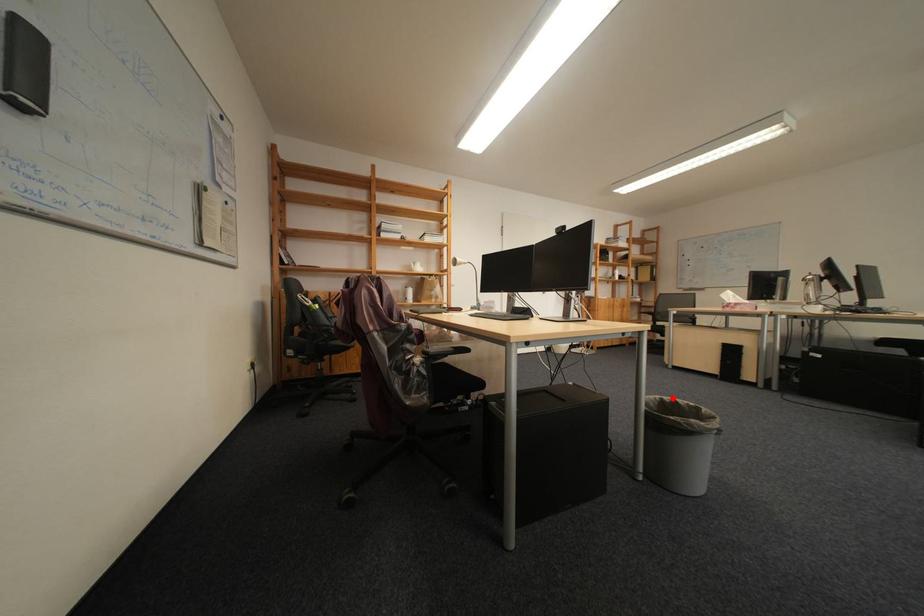
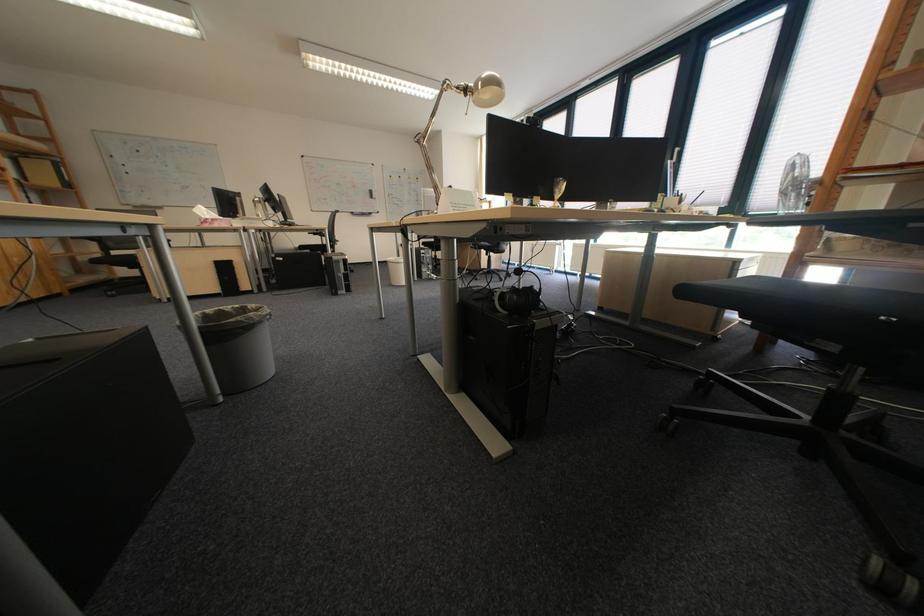
Question: I am providing you with two images of the same scene from different viewpoints. A red point is marked on the first image. Can you still see the location of the red point in image 2?

Choices:
 (A) Yes
 (B) No

Answer: (A)